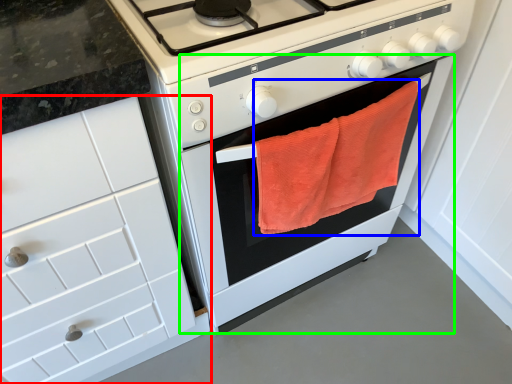
Question: Considering the real-world distances, which object is closest to cabinetry (highlighted by a red box)? beach towel (highlighted by a blue box) or oven (highlighted by a green box).

Choices:
 (A) beach towel
 (B) oven

Answer: (B)